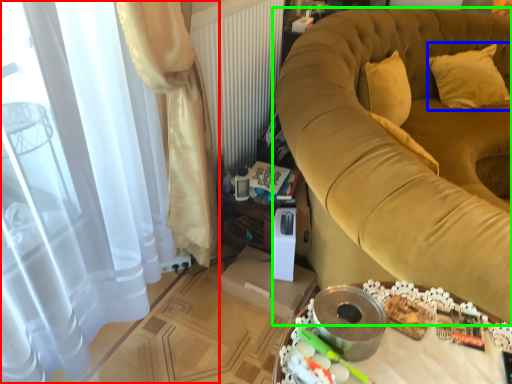
Question: Considering the real-world distances, which object is closest to curtain (highlighted by a red box)? pillow (highlighted by a blue box) or furniture (highlighted by a green box).

Choices:
 (A) pillow
 (B) furniture

Answer: (B)